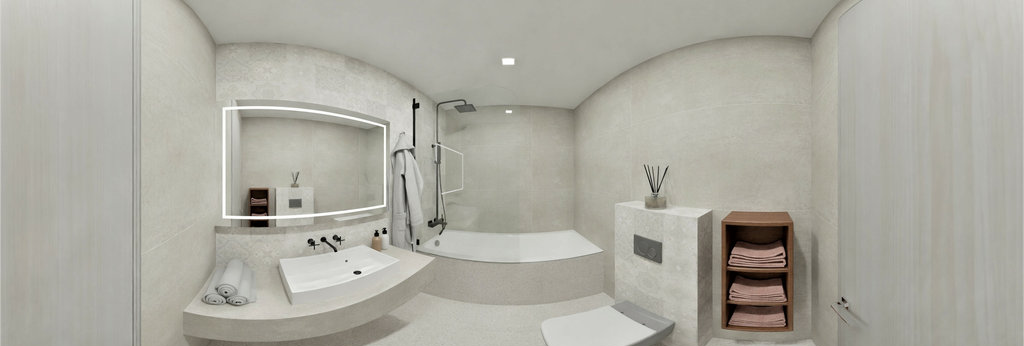
Image resolution: width=1024 pixels, height=346 pixels. I want to click on mirror, so click(x=310, y=151).